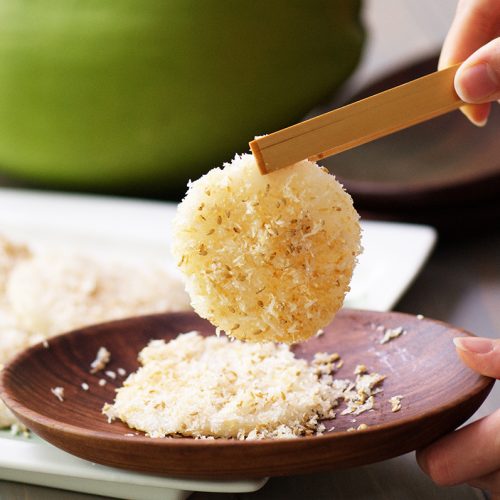
Find the location of a particular element. The width and height of the screenshot is (500, 500). wooden plate is located at coordinates (429, 386).